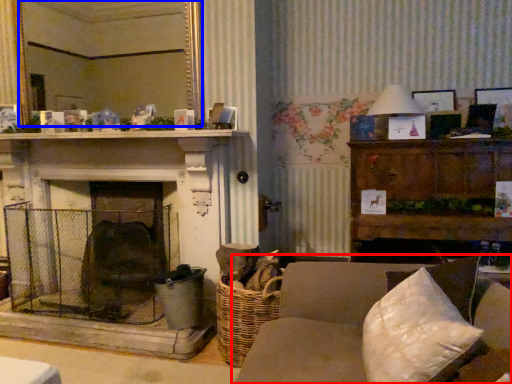
Question: Which point is further to the camera, studio couch (highlighted by a red box) or mirror (highlighted by a blue box)?

Choices:
 (A) studio couch
 (B) mirror

Answer: (B)